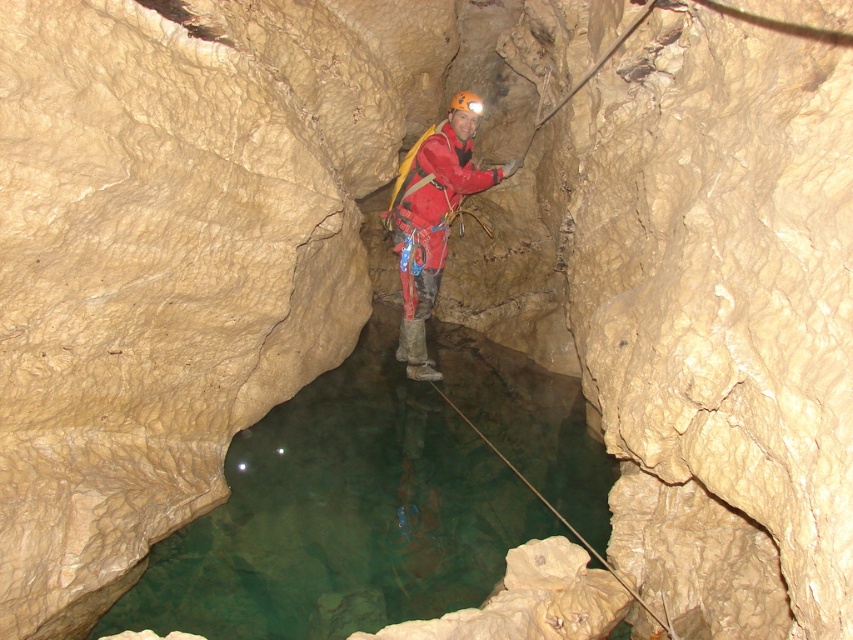
Question: Does clear water at center appear on the left side of red matte jacket at center?

Choices:
 (A) no
 (B) yes

Answer: (B)

Question: Does clear water at center appear on the left side of red matte jacket at center?

Choices:
 (A) yes
 (B) no

Answer: (A)

Question: Which point is closer to the camera?

Choices:
 (A) (253, 461)
 (B) (416, 243)

Answer: (A)

Question: Is clear water at center to the right of red matte jacket at center from the viewer's perspective?

Choices:
 (A) no
 (B) yes

Answer: (A)